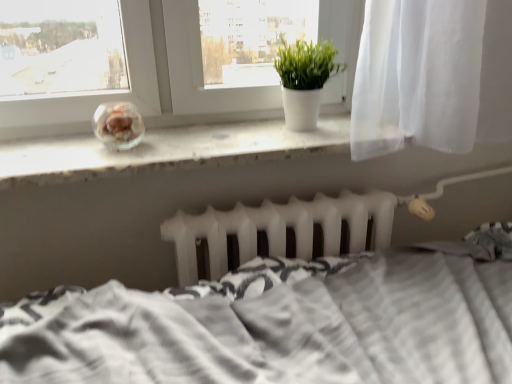
Image resolution: width=512 pixels, height=384 pixels. In order to click on free space to the left of translucent glass jar at center in this screenshot , I will do `click(56, 148)`.